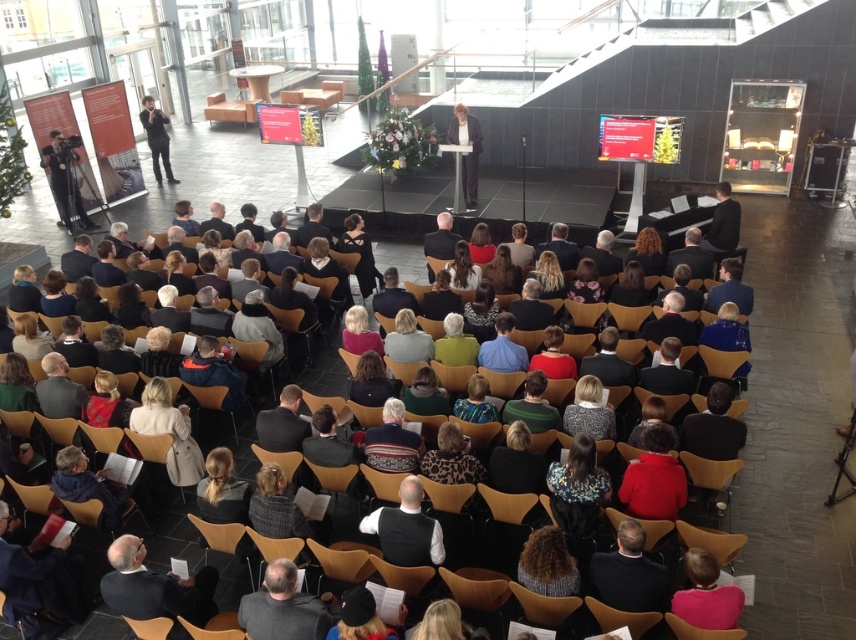
Consider the image. Between black vest at center and dark gray suit at left, which one is positioned higher?

dark gray suit at left is above.

Between black vest at center and dark gray suit at left, which one is positioned lower?

black vest at center is lower down.

What do you see at coordinates (406, 529) in the screenshot? I see `black vest at center` at bounding box center [406, 529].

The height and width of the screenshot is (640, 856). I want to click on black vest at center, so click(406, 529).

Can you confirm if light beige coat at center is shorter than black fabric jacket at center?

Yes, light beige coat at center is shorter than black fabric jacket at center.

The width and height of the screenshot is (856, 640). What do you see at coordinates (168, 432) in the screenshot?
I see `light beige coat at center` at bounding box center [168, 432].

Where is `light beige coat at center`? This screenshot has width=856, height=640. light beige coat at center is located at coordinates (168, 432).

Based on the photo, does light beige coat at center appear on the right side of red matte sweater at center?

No, light beige coat at center is not to the right of red matte sweater at center.

This screenshot has width=856, height=640. What do you see at coordinates (168, 432) in the screenshot?
I see `light beige coat at center` at bounding box center [168, 432].

Identify the location of light beige coat at center. (x=168, y=432).